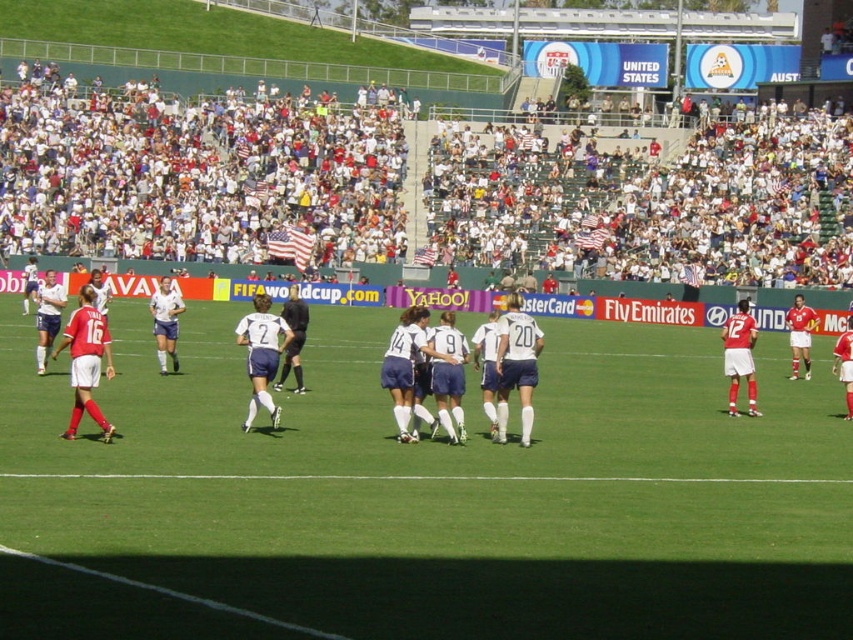
Question: Which point appears farthest from the camera in this image?

Choices:
 (A) (792, 484)
 (B) (299, 346)

Answer: (B)

Question: Which point is farther to the camera?

Choices:
 (A) white jersey at center
 (B) green grass football field at center

Answer: (A)

Question: Does white fabric crowd at upper center have a lesser width compared to blue fabric soccer players at center?

Choices:
 (A) yes
 (B) no

Answer: (B)

Question: Does white fabric crowd at upper center lie in front of white jersey at center?

Choices:
 (A) no
 (B) yes

Answer: (A)

Question: Is the position of green grass football field at center less distant than that of blue fabric soccer players at center?

Choices:
 (A) yes
 (B) no

Answer: (A)

Question: Which object appears closest to the camera in this image?

Choices:
 (A) blue fabric soccer players at center
 (B) green grass football field at center
 (C) white fabric crowd at upper center
 (D) white jersey at center

Answer: (B)